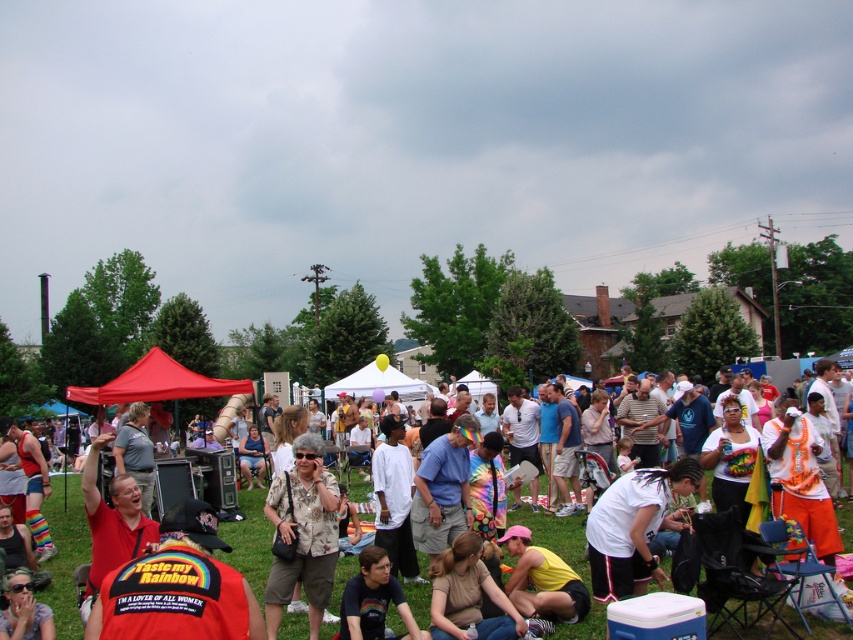
Consider the image. Which is above, matte pink shirt at center or red fabric shirt at center?

red fabric shirt at center is above.

Who is taller, matte pink shirt at center or red fabric shirt at center?

Standing taller between the two is red fabric shirt at center.

Which is behind, point (440, 628) or point (132, 552)?

The point (132, 552) is behind.

Identify the location of matte pink shirt at center. (468, 595).

Who is positioned more to the right, matte black t-shirt at center or matte pink shirt at center?

matte pink shirt at center is more to the right.

Locate an element on the screen. This screenshot has width=853, height=640. matte black t-shirt at center is located at coordinates (65, 554).

Describe the element at coordinates (65, 554) in the screenshot. This screenshot has width=853, height=640. I see `matte black t-shirt at center` at that location.

Locate an element on the screen. matte black t-shirt at center is located at coordinates (65, 554).

Who is more distant from viewer, (267,580) or (671,524)?

The point (267,580) is behind.

Can you confirm if printed fabric shirt at center is thinner than white matte shirt at center?

Yes, printed fabric shirt at center is thinner than white matte shirt at center.

Find the location of a particular element. printed fabric shirt at center is located at coordinates (302, 532).

Locate an element on the screen. Image resolution: width=853 pixels, height=640 pixels. printed fabric shirt at center is located at coordinates (302, 532).